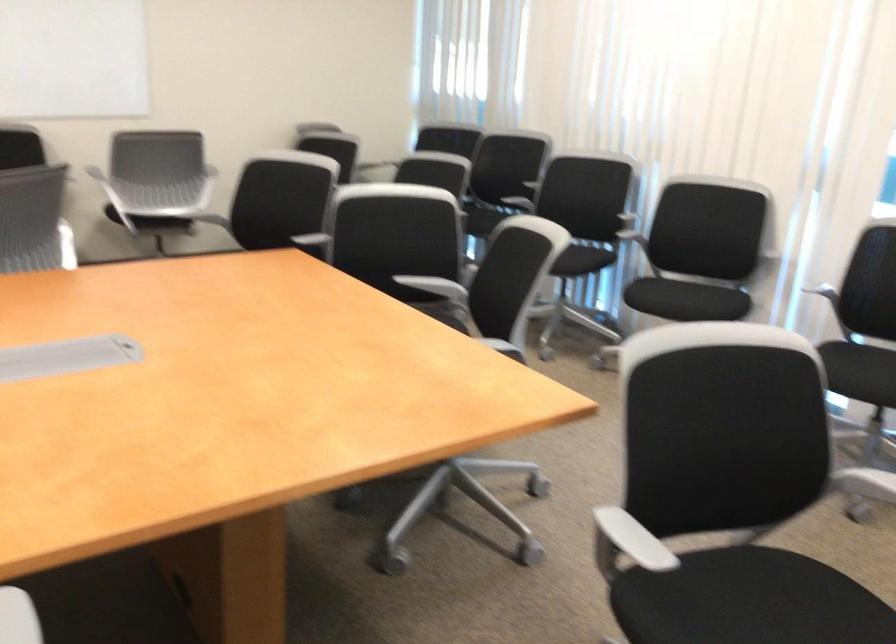
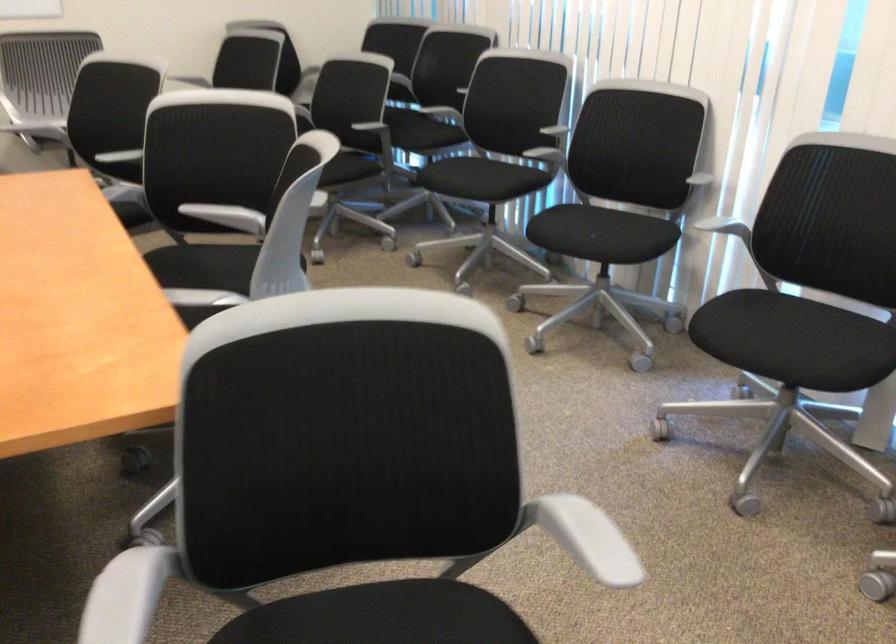
Locate, in the second image, the point that corresponds to point 566,252 in the first image.

(480, 178)